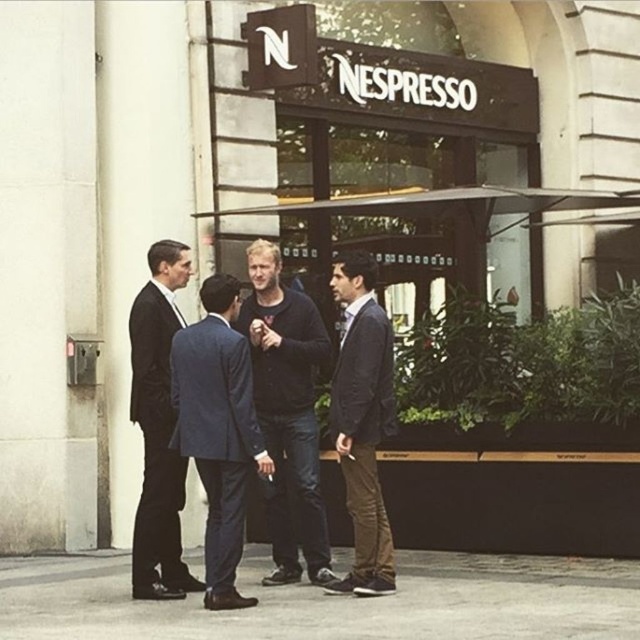
You are a photographer trying to capture a group photo of the dark blue jeans at center and the blue fabric suit at center. Since you want both subjects to appear equally sized in the photo, which subject should you move closer to the camera?

The dark blue jeans at center should be moved closer to the camera because its width is larger than the blue fabric suit at center, so moving it closer will help balance their sizes in the photo.

You are a photographer standing in front of the Nespresso store. You notice two people at center wearing dark blue jeans at center and blue fabric suit at center. Which one is standing to the right of the other?

The dark blue jeans at center is positioned on the right side of blue fabric suit at center.